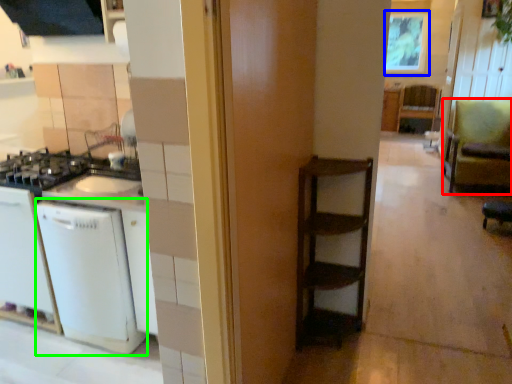
Question: Estimate the real-world distances between objects in this image. Which object is closer to armchair (highlighted by a red box), window screen (highlighted by a blue box) or dish washer (highlighted by a green box)?

Choices:
 (A) window screen
 (B) dish washer

Answer: (A)